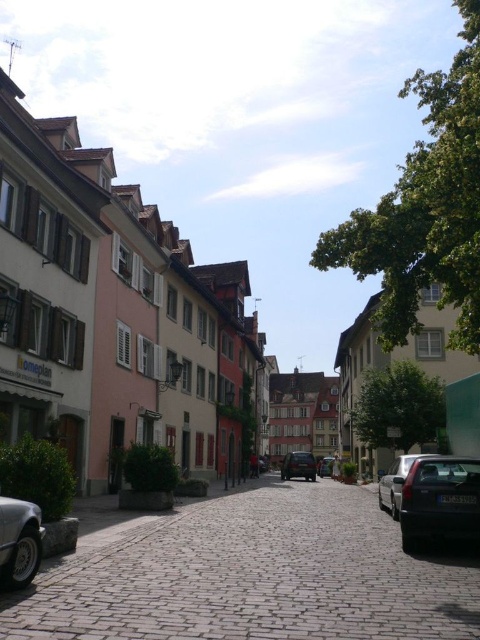
Which is below, brown cobblestone alley at center or satin silver sedan at center?

satin silver sedan at center is below.

Is point (330, 522) behind point (393, 490)?

No, (330, 522) is in front of (393, 490).

In order to click on brown cobblestone alley at center in this screenshot , I will do `click(252, 576)`.

Describe the element at coordinates (19, 541) in the screenshot. I see `silver metallic car at lower left` at that location.

Is silver metallic car at lower left shorter than satin silver sedan at center?

Yes, silver metallic car at lower left is shorter than satin silver sedan at center.

Is point (10, 554) closer to camera compared to point (395, 484)?

Yes, it is.

The height and width of the screenshot is (640, 480). In order to click on silver metallic car at lower left in this screenshot , I will do `click(19, 541)`.

Does point (218, 316) come in front of point (205, 605)?

That is False.

Does matte stone street at center appear under brown cobblestone alley at center?

Indeed, matte stone street at center is positioned under brown cobblestone alley at center.

The height and width of the screenshot is (640, 480). What do you see at coordinates (110, 314) in the screenshot? I see `matte stone street at center` at bounding box center [110, 314].

Where is `matte stone street at center`? matte stone street at center is located at coordinates (110, 314).